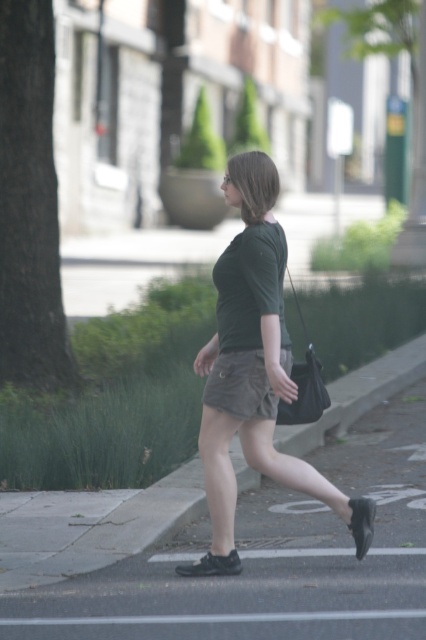
Between green matte skirt at center and khaki cotton shorts at center, which one is positioned lower?

khaki cotton shorts at center

Between point (261, 230) and point (256, 413), which one is positioned in front?

Positioned in front is point (261, 230).

Identify the location of green matte skirt at center. The height and width of the screenshot is (640, 426). (253, 371).

You are a GUI agent. You are given a task and a screenshot of the screen. Output one action in this format:
    pyautogui.click(x=<x>, y=<y>)
    Task: Click on the green matte skirt at center
    The height and width of the screenshot is (640, 426).
    Given the screenshot: What is the action you would take?
    pyautogui.click(x=253, y=371)

Is the position of green matte skirt at center less distant than that of black fabric bag at lower center?

Yes, it is in front of black fabric bag at lower center.

Who is positioned more to the left, green matte skirt at center or black fabric bag at lower center?

green matte skirt at center is more to the left.

Is point (271, 339) closer to viewer compared to point (307, 365)?

Yes, it is in front of point (307, 365).

Where is `green matte skirt at center`? The height and width of the screenshot is (640, 426). green matte skirt at center is located at coordinates (253, 371).

Can you confirm if khaki cotton shorts at center is wider than black fabric bag at lower center?

Correct, the width of khaki cotton shorts at center exceeds that of black fabric bag at lower center.

Who is taller, khaki cotton shorts at center or black fabric bag at lower center?

With more height is khaki cotton shorts at center.

Is point (232, 365) behind point (308, 397)?

No.

In order to click on khaki cotton shorts at center in this screenshot , I will do `click(241, 385)`.